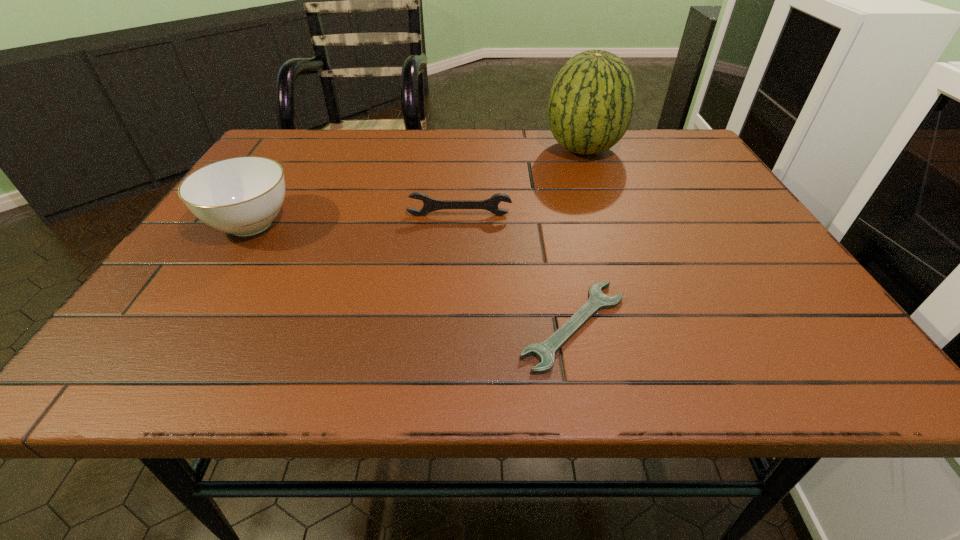
In order to click on the farthest object in this screenshot , I will do `click(592, 100)`.

The height and width of the screenshot is (540, 960). I want to click on the tallest object, so click(x=592, y=100).

This screenshot has height=540, width=960. What are the coordinates of `chinaware` in the screenshot? It's located at (242, 196).

Identify the location of the leftmost object. The image size is (960, 540). (242, 196).

Where is `the taller wrench`? Image resolution: width=960 pixels, height=540 pixels. the taller wrench is located at coordinates (430, 204).

Where is `the second shortest object`? The height and width of the screenshot is (540, 960). the second shortest object is located at coordinates (430, 204).

I want to click on the nearer wrench, so pos(544,351).

At what (x,y) coordinates should I click in order to perform the action: click on the nearest object. Please return your answer as a coordinate pair (x, y). Looking at the image, I should click on [x=544, y=351].

This screenshot has height=540, width=960. Find the location of `free point located 0.220m on the front of the tallest object`. free point located 0.220m on the front of the tallest object is located at coordinates (609, 219).

Find the location of a particular element. vacant space located 0.360m on the right of the chinaware is located at coordinates (463, 224).